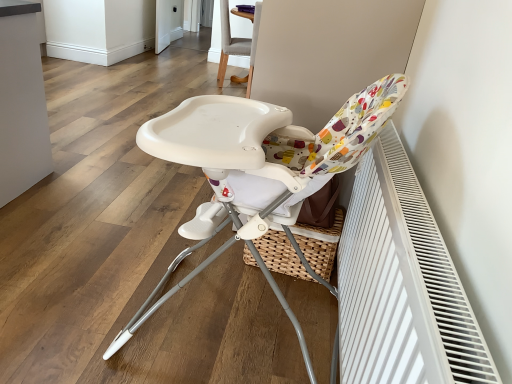
Question: Is white plastic highchair at center, marked as the 1th chair in a bottom-to-top arrangement, in front of or behind white textured radiator at right in the image?

Choices:
 (A) behind
 (B) front

Answer: (A)

Question: Looking at their shapes, would you say white plastic highchair at center, arranged as the 2th chair when viewed from the top, is wider or thinner than white textured radiator at right?

Choices:
 (A) thin
 (B) wide

Answer: (B)

Question: Which of these objects is positioned closest to the light gray fabric chair at upper center, which is the second chair from bottom to top?

Choices:
 (A) white textured radiator at right
 (B) white plastic highchair at center, marked as the 1th chair in a bottom-to-top arrangement
 (C) white glossy screen door at upper center

Answer: (C)

Question: Estimate the real-world distances between objects in this image. Which object is farther from the light gray fabric chair at upper center, which is the second chair from bottom to top?

Choices:
 (A) white plastic highchair at center, which is counted as the second chair, starting from the back
 (B) white glossy screen door at upper center
 (C) white textured radiator at right

Answer: (C)